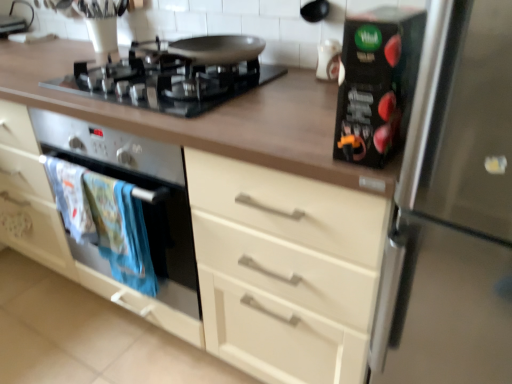
This screenshot has height=384, width=512. Identify the location of free space below white fabric towels at lower left (from a real-world perspective). (121, 342).